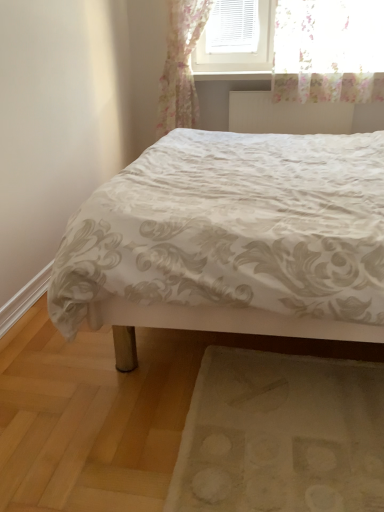
Question: From a real-world perspective, is white textured radiator at upper center on top of beige fabric mat at lower right?

Choices:
 (A) no
 (B) yes

Answer: (B)

Question: Considering the relative sizes of white textured radiator at upper center and beige fabric mat at lower right in the image provided, is white textured radiator at upper center wider than beige fabric mat at lower right?

Choices:
 (A) no
 (B) yes

Answer: (A)

Question: Is white textured radiator at upper center positioned in front of beige fabric mat at lower right?

Choices:
 (A) yes
 (B) no

Answer: (B)

Question: Is white textured radiator at upper center next to beige fabric mat at lower right?

Choices:
 (A) yes
 (B) no

Answer: (B)

Question: Is white textured radiator at upper center looking in the opposite direction of beige fabric mat at lower right?

Choices:
 (A) yes
 (B) no

Answer: (B)

Question: From a real-world perspective, is white textured radiator at upper center above or below beige fabric mat at lower right?

Choices:
 (A) below
 (B) above

Answer: (B)

Question: Considering the positions of white textured radiator at upper center and beige fabric mat at lower right in the image, is white textured radiator at upper center bigger or smaller than beige fabric mat at lower right?

Choices:
 (A) small
 (B) big

Answer: (A)

Question: Considering the relative positions of white textured radiator at upper center and beige fabric mat at lower right in the image provided, is white textured radiator at upper center to the left or to the right of beige fabric mat at lower right?

Choices:
 (A) left
 (B) right

Answer: (B)

Question: Is white textured radiator at upper center situated inside beige fabric mat at lower right or outside?

Choices:
 (A) inside
 (B) outside

Answer: (B)

Question: From the image's perspective, relative to beige fabric mat at lower right, is white satin bed at center above or below?

Choices:
 (A) above
 (B) below

Answer: (A)

Question: From a real-world perspective, is white satin bed at center physically located above or below beige fabric mat at lower right?

Choices:
 (A) above
 (B) below

Answer: (A)

Question: Relative to beige fabric mat at lower right, is white satin bed at center in front or behind?

Choices:
 (A) behind
 (B) front

Answer: (B)

Question: Is white satin bed at center to the left or to the right of beige fabric mat at lower right in the image?

Choices:
 (A) left
 (B) right

Answer: (B)

Question: Is beige fabric mat at lower right taller or shorter than white textured radiator at upper center?

Choices:
 (A) short
 (B) tall

Answer: (A)

Question: From the image's perspective, relative to white textured radiator at upper center, is beige fabric mat at lower right above or below?

Choices:
 (A) above
 (B) below

Answer: (B)